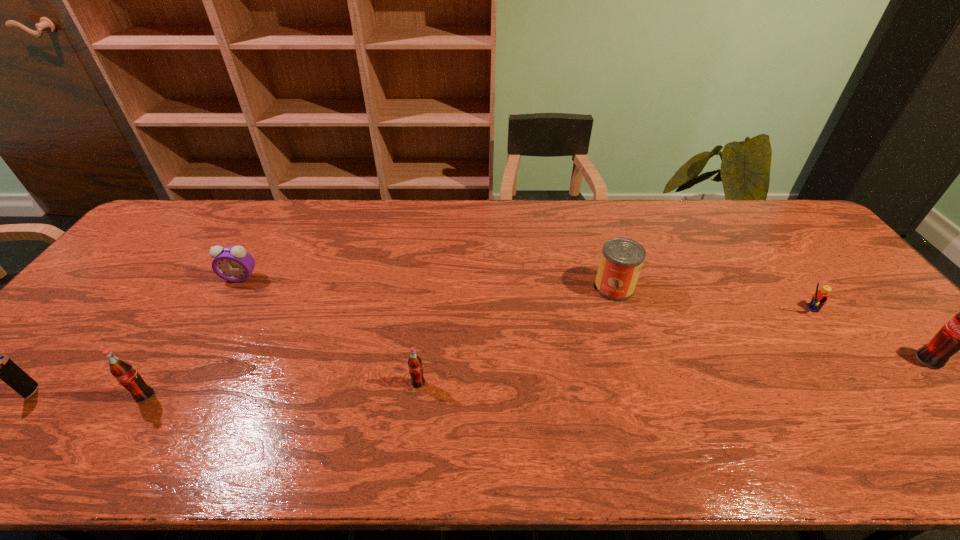
Locate an element on the screen. object present at the near left corner is located at coordinates (3, 368).

Image resolution: width=960 pixels, height=540 pixels. In the image, there is a desktop. Identify the location of free space at the far edge. (235, 212).

You are a GUI agent. You are given a task and a screenshot of the screen. Output one action in this format:
    pyautogui.click(x=<x>, y=<y>)
    Task: Click on the vacant space at the near edge of the desktop
    The image size is (960, 540).
    Given the screenshot: What is the action you would take?
    pyautogui.click(x=701, y=386)

Locate an element on the screen. vacant space at the right edge of the desktop is located at coordinates (887, 316).

Identify the location of free region at the near left corner. (1, 400).

Find the location of a particular element. vacant area that lies between the can and the alarm clock is located at coordinates (427, 282).

Where is `free space between the Lego and the fourth nearest object`? free space between the Lego and the fourth nearest object is located at coordinates (866, 334).

Locate an element on the screen. The image size is (960, 540). vacant area between the rightmost soda bottle and the second object from right to left is located at coordinates tap(866, 334).

Find the location of a particular element. The width and height of the screenshot is (960, 540). vacant area that lies between the Lego and the second shortest soda bottle is located at coordinates (475, 352).

At what (x,y) coordinates should I click in order to perform the action: click on vacant area that lies between the igniter and the leftmost soda bottle. Please return your answer as a coordinate pair (x, y). This screenshot has width=960, height=540. Looking at the image, I should click on (88, 393).